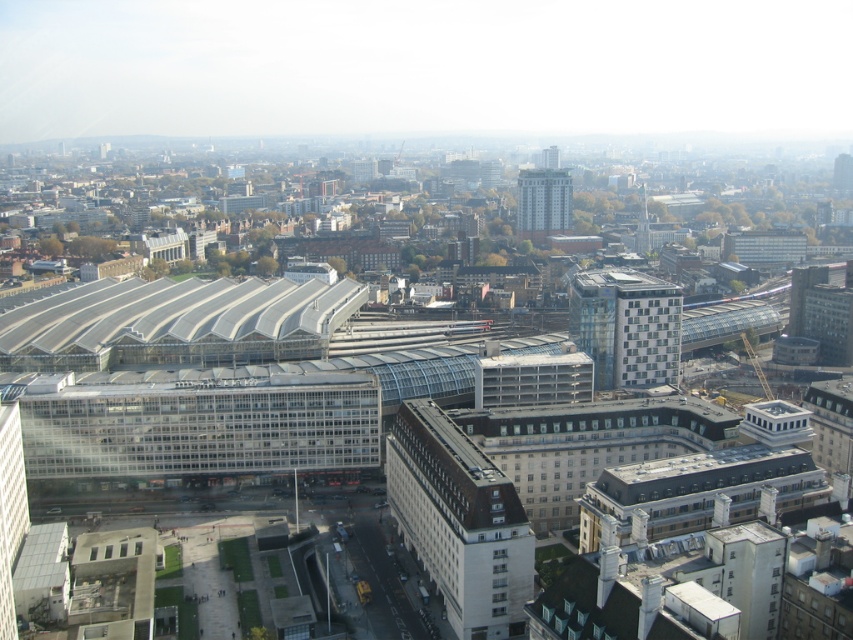
You are a drone operator trying to deliver a package to a specific location marked by the point at coordinates (x=459, y=522). The delivery zone is on the dark gray concrete building at center. Can you confirm if the point is on the correct building?

Yes, the point at coordinates (x=459, y=522) is on the dark gray concrete building at center, so it is on the correct building for delivery.

You are a city planner reviewing this urban layout. You notice the glassy blue building at center and the gray concrete building at center. Based on their spatial arrangement, which one is positioned to the east of the other?

The glassy blue building at center is to the right of gray concrete building at center. Since in aerial views, right typically corresponds to east, the glassy blue building at center is positioned to the east of the gray concrete building at center.

You are a city planner analyzing the urban layout. Given the glassy blue building at center and the gray concrete building at center, which one occupies more area in the cityscape?

The glassy blue building at center has a larger size compared to the gray concrete building at center, so it occupies more area in the cityscape.